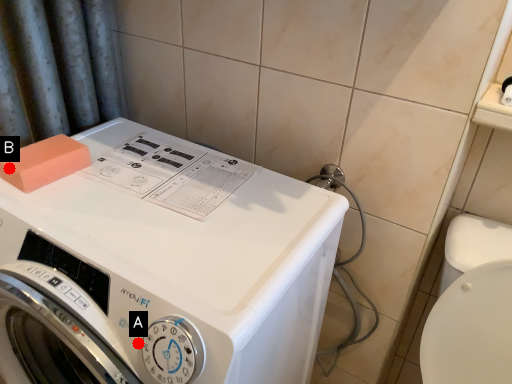
Question: Two points are circled on the image, labeled by A and B beside each circle. Which point is closer to the camera?

Choices:
 (A) A is closer
 (B) B is closer

Answer: (A)